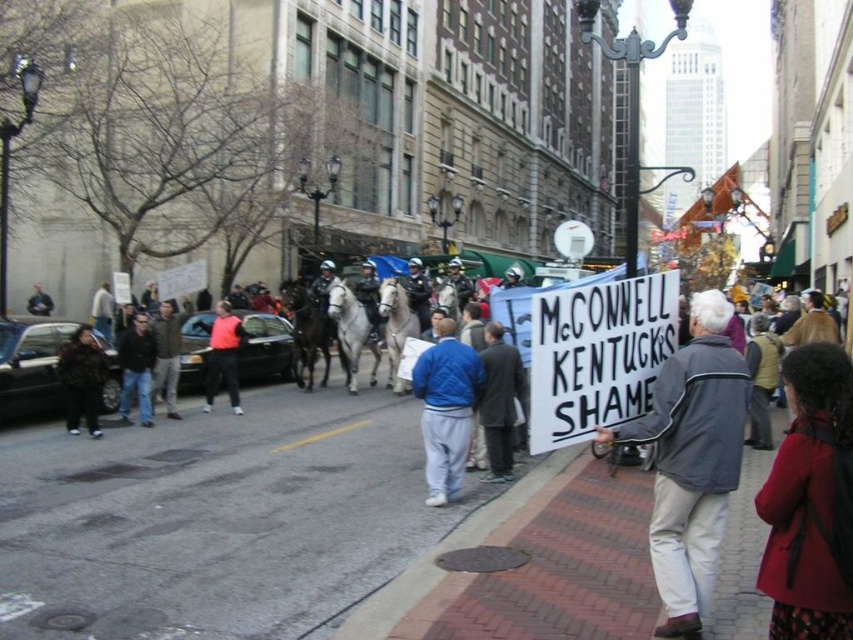
Can you confirm if gray fleece jacket at center is taller than dark blue jeans at left?

No, gray fleece jacket at center is not taller than dark blue jeans at left.

Can you confirm if gray fleece jacket at center is positioned above dark blue jeans at left?

Incorrect, gray fleece jacket at center is not positioned above dark blue jeans at left.

Is point (660, 564) farther from camera compared to point (134, 339)?

No, it is not.

Identify the location of gray fleece jacket at center. click(692, 460).

Is point (457, 433) more distant than point (149, 422)?

No, it is in front of (149, 422).

Is point (424, 397) closer to camera compared to point (148, 337)?

That is True.

Where is `blue fleece jacket at center`? blue fleece jacket at center is located at coordinates (445, 410).

Which of these two, blue fleece jacket at center or dark blue jacket at center, stands taller?

Standing taller between the two is blue fleece jacket at center.

Is blue fleece jacket at center to the right of dark blue jacket at center from the viewer's perspective?

Correct, you'll find blue fleece jacket at center to the right of dark blue jacket at center.

Who is more distant from viewer, (447, 412) or (39, 291)?

Positioned behind is point (39, 291).

Image resolution: width=853 pixels, height=640 pixels. Identify the location of blue fleece jacket at center. (445, 410).